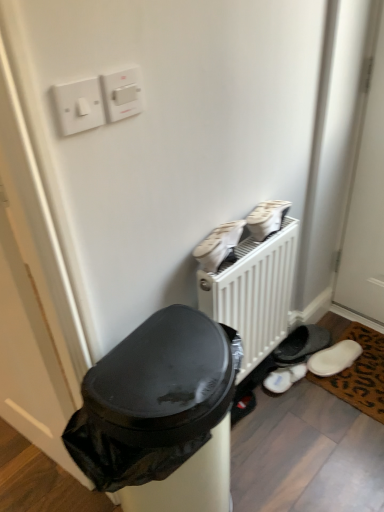
This screenshot has width=384, height=512. In order to click on free point above brown leopard print mat at lower right (from a real-world perspective) in this screenshot , I will do 363,367.